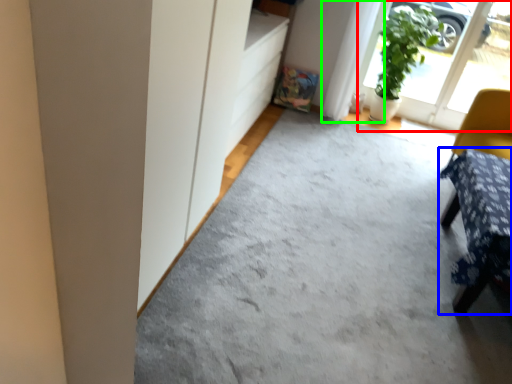
Question: Which is farther away from screen door (highlighted by a red box)? furniture (highlighted by a blue box) or curtain (highlighted by a green box)?

Choices:
 (A) furniture
 (B) curtain

Answer: (A)